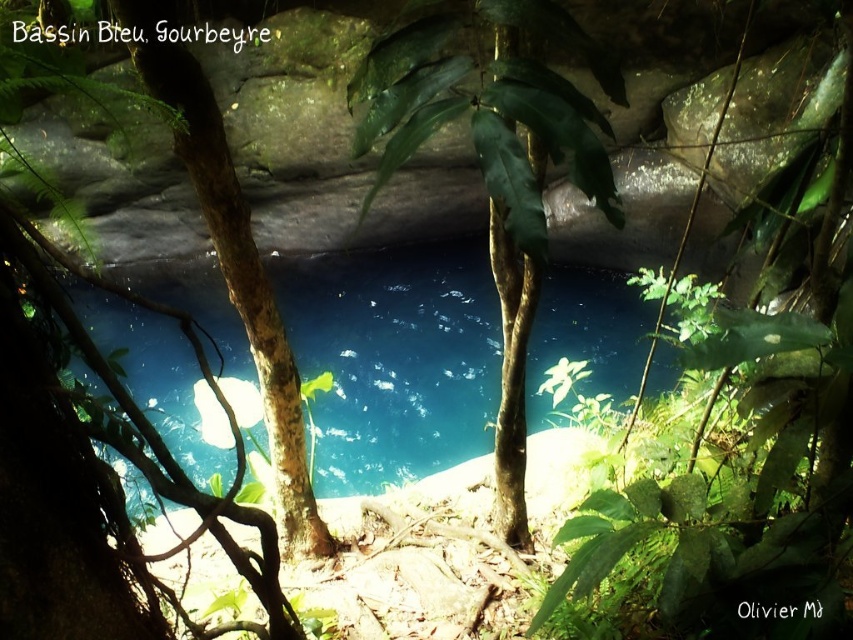
Question: Observing the image, what is the correct spatial positioning of green rough bark tree at center in reference to brown rough tree trunk at center?

Choices:
 (A) right
 (B) left

Answer: (A)

Question: Which object appears farthest from the camera in this image?

Choices:
 (A) transparent blue water at center
 (B) brown rough tree trunk at center

Answer: (A)

Question: Which of the following is the closest to the observer?

Choices:
 (A) tap(363, 140)
 (B) tap(341, 348)

Answer: (A)

Question: Which object is farther from the camera taking this photo?

Choices:
 (A) green rough bark tree at center
 (B) brown rough tree trunk at center
 (C) transparent blue water at center

Answer: (C)

Question: Can you confirm if transparent blue water at center is positioned to the left of green rough bark tree at center?

Choices:
 (A) yes
 (B) no

Answer: (A)

Question: Where is transparent blue water at center located in relation to green rough bark tree at center in the image?

Choices:
 (A) left
 (B) right

Answer: (A)